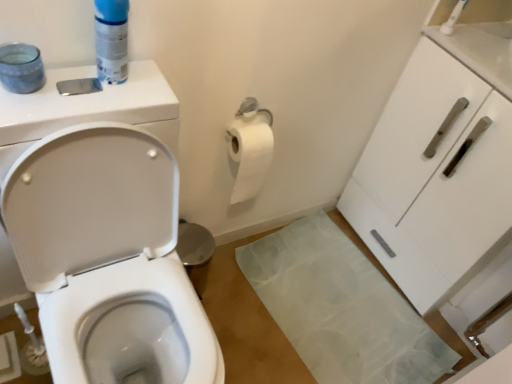
This screenshot has width=512, height=384. I want to click on white glossy toilet at left, so click(108, 258).

You are a GUI agent. You are given a task and a screenshot of the screen. Output one action in this format:
    pyautogui.click(x=<x>, y=<y>)
    Task: Click on the blue plastic can at upper left
    Image resolution: width=512 pixels, height=384 pixels.
    Given the screenshot: What is the action you would take?
    pyautogui.click(x=111, y=40)

I want to click on white glossy toilet at left, so click(108, 258).

Is point (106, 52) positioned before point (480, 267)?

Yes, point (106, 52) is closer to viewer.

Can you tell me how much blue plastic can at upper left and white glossy cabinet at right differ in facing direction?

The facing directions of blue plastic can at upper left and white glossy cabinet at right are 92.9 degrees apart.

How distant is blue plastic can at upper left from white glossy cabinet at right?

blue plastic can at upper left and white glossy cabinet at right are 1.07 meters apart.

Is blue plastic can at upper left facing away from white glossy cabinet at right?

That's not correct — blue plastic can at upper left is not looking away from white glossy cabinet at right.

From the image's perspective, which is below, white glossy cabinet at right or blue plastic can at upper left?

white glossy cabinet at right is shown below in the image.

Consider the image. Which object is positioned more to the left, white glossy cabinet at right or blue plastic can at upper left?

Positioned to the left is blue plastic can at upper left.

Can you tell me how much white glossy cabinet at right and blue plastic can at upper left differ in facing direction?

The angle between the facing direction of white glossy cabinet at right and the facing direction of blue plastic can at upper left is 92.9 degrees.

Which of these two, white glossy cabinet at right or blue plastic can at upper left, is wider?

Wider between the two is white glossy cabinet at right.

How many degrees apart are the facing directions of white glossy toilet at left and blue plastic can at upper left?

3.96 degrees.

From a real-world perspective, is white glossy toilet at left over blue plastic can at upper left?

No.

From the image's perspective, is white glossy toilet at left above or below blue plastic can at upper left?

white glossy toilet at left is situated lower than blue plastic can at upper left in the image.

Is white glossy toilet at left facing towards blue plastic can at upper left?

No, white glossy toilet at left is not aimed at blue plastic can at upper left.

From the picture: Considering the relative sizes of blue plastic can at upper left and white glossy toilet at left in the image provided, is blue plastic can at upper left wider than white glossy toilet at left?

No, blue plastic can at upper left is not wider than white glossy toilet at left.

From the image's perspective, is blue plastic can at upper left located above or below white glossy toilet at left?

From the image's perspective, blue plastic can at upper left appears above white glossy toilet at left.

Can you tell me how much blue plastic can at upper left and white glossy toilet at left differ in facing direction?

blue plastic can at upper left and white glossy toilet at left are facing 3.96 degrees away from each other.

Are blue plastic can at upper left and white glossy toilet at left located far from each other?

blue plastic can at upper left is near white glossy toilet at left, not far away.

Between point (482, 89) and point (154, 217), which one is positioned behind?

The point (482, 89) is behind.

Would you say white glossy cabinet at right is outside white glossy toilet at left?

Yes, white glossy cabinet at right is outside of white glossy toilet at left.

Is white glossy cabinet at right in contact with white glossy toilet at left?

No, white glossy cabinet at right is not with white glossy toilet at left.

Considering the relative sizes of white glossy cabinet at right and white glossy toilet at left in the image provided, is white glossy cabinet at right wider than white glossy toilet at left?

Incorrect, the width of white glossy cabinet at right does not surpass that of white glossy toilet at left.

Based on their positions, is white glossy toilet at left located to the left or right of white glossy cabinet at right?

From the image, it's evident that white glossy toilet at left is to the left of white glossy cabinet at right.

Between white glossy toilet at left and white glossy cabinet at right, which one has more height?

white glossy toilet at left is taller.

Which object is wider, white glossy toilet at left or white glossy cabinet at right?

white glossy toilet at left.

Would you consider white glossy toilet at left to be distant from white glossy cabinet at right?

No, white glossy toilet at left is not far from white glossy cabinet at right.

Find the location of `cabinetry behind the blue plastic can at upper left`. cabinetry behind the blue plastic can at upper left is located at coordinates click(x=435, y=178).

In order to click on cleaning product lying on the left of white glossy cabinet at right in this screenshot , I will do `click(111, 40)`.

From the image, which object appears to be farther from white glossy toilet at left, white glossy cabinet at right or blue plastic can at upper left?

white glossy cabinet at right lies further to white glossy toilet at left than the other object.

Considering their positions, is blue plastic can at upper left positioned further to white glossy toilet at left than white glossy cabinet at right?

Among the two, white glossy cabinet at right is located further to white glossy toilet at left.

From the image, which object appears to be farther from white glossy cabinet at right, blue plastic can at upper left or white glossy toilet at left?

blue plastic can at upper left is further to white glossy cabinet at right.

Which object lies further to the anchor point blue plastic can at upper left, white glossy cabinet at right or white glossy toilet at left?

white glossy cabinet at right.

Which object lies nearer to the anchor point blue plastic can at upper left, white glossy toilet at left or white glossy cabinet at right?

white glossy toilet at left is positioned closer to the anchor blue plastic can at upper left.

When comparing their distances from white glossy cabinet at right, does white glossy toilet at left or blue plastic can at upper left seem closer?

white glossy toilet at left is positioned closer to the anchor white glossy cabinet at right.

Locate an element on the screen. cleaning product situated between white glossy toilet at left and white glossy cabinet at right from left to right is located at coordinates (111, 40).